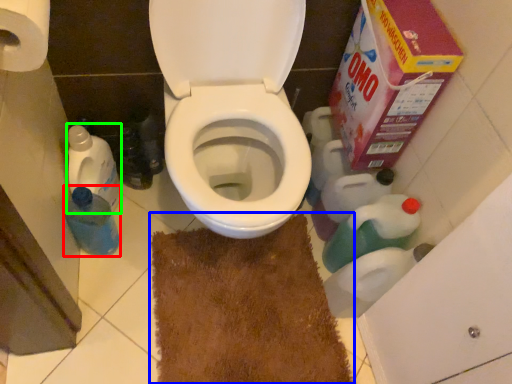
Question: Which object is the farthest from bottle (highlighted by a red box)? Choose among these: doormat (highlighted by a blue box) or cleaning product (highlighted by a green box).

Choices:
 (A) doormat
 (B) cleaning product

Answer: (A)